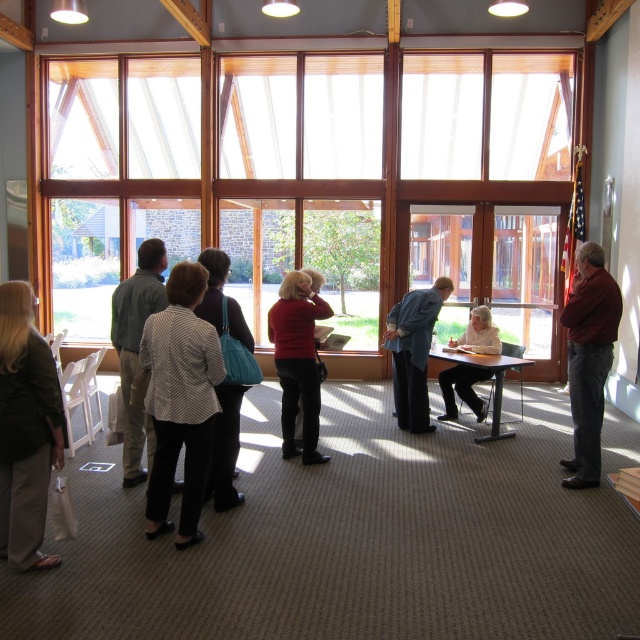
Question: Does patterned fabric blouse at center have a lesser width compared to patterned fabric jacket at center?

Choices:
 (A) yes
 (B) no

Answer: (B)

Question: Estimate the real-world distances between objects in this image. Which object is farther from the patterned fabric jacket at center?

Choices:
 (A) dark red shirt at right
 (B) white matte shirt at center
 (C) patterned fabric blouse at center

Answer: (B)

Question: Which object appears farthest from the camera in this image?

Choices:
 (A) green cotton shirt at center
 (B) dark red shirt at right

Answer: (B)

Question: Based on their relative distances, which object is nearer to the dark gray suit at center?

Choices:
 (A) dark green jacket at left
 (B) dark red shirt at right
 (C) patterned fabric blouse at center
 (D) patterned fabric jacket at center

Answer: (B)

Question: Is clear glass window at center to the right of patterned fabric blouse at center from the viewer's perspective?

Choices:
 (A) yes
 (B) no

Answer: (A)

Question: Can you confirm if dark red shirt at right is wider than dark gray suit at center?

Choices:
 (A) yes
 (B) no

Answer: (B)